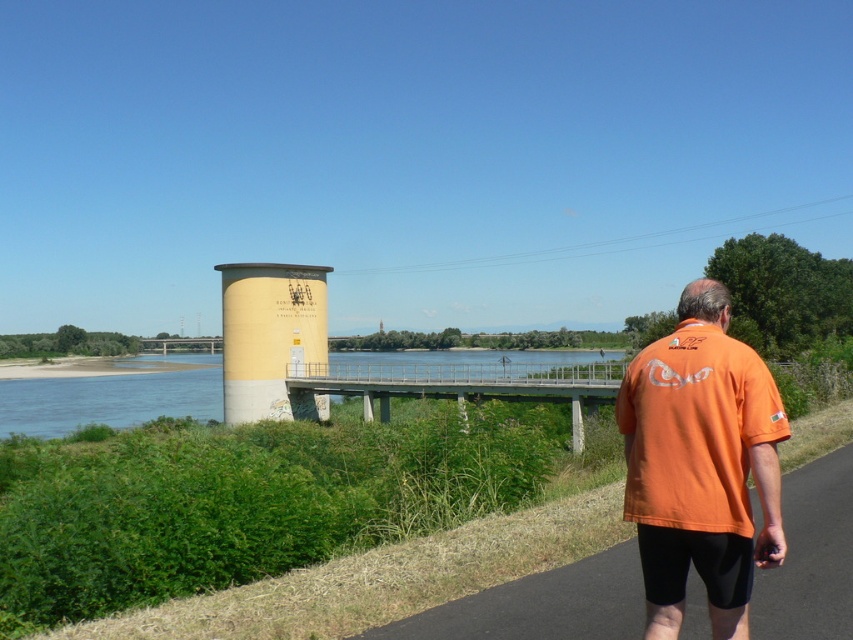
Does point (254, 275) come in front of point (494, 394)?

That is False.

Which of these two, yellow concrete pillar at center or metallic gray bridge at center, stands shorter?

metallic gray bridge at center is shorter.

Between point (299, 348) and point (436, 387), which one is positioned behind?

Point (299, 348)

The image size is (853, 640). I want to click on yellow concrete pillar at center, so pos(271,339).

Between point (712, 444) and point (419, 394), which one is positioned in front?

Point (712, 444) is more forward.

Can you confirm if orange fabric shirt at right is bigger than metallic gray bridge at center?

No.

Where is `orange fabric shirt at right`? orange fabric shirt at right is located at coordinates (700, 465).

The image size is (853, 640). I want to click on orange fabric shirt at right, so click(x=700, y=465).

Between orange fabric shirt at right and black asphalt bike path at lower right, which one has less height?

With less height is black asphalt bike path at lower right.

Can you confirm if orange fabric shirt at right is shorter than black asphalt bike path at lower right?

No, orange fabric shirt at right is not shorter than black asphalt bike path at lower right.

Does point (747, 627) lie in front of point (590, 596)?

That is True.

I want to click on orange fabric shirt at right, so click(700, 465).